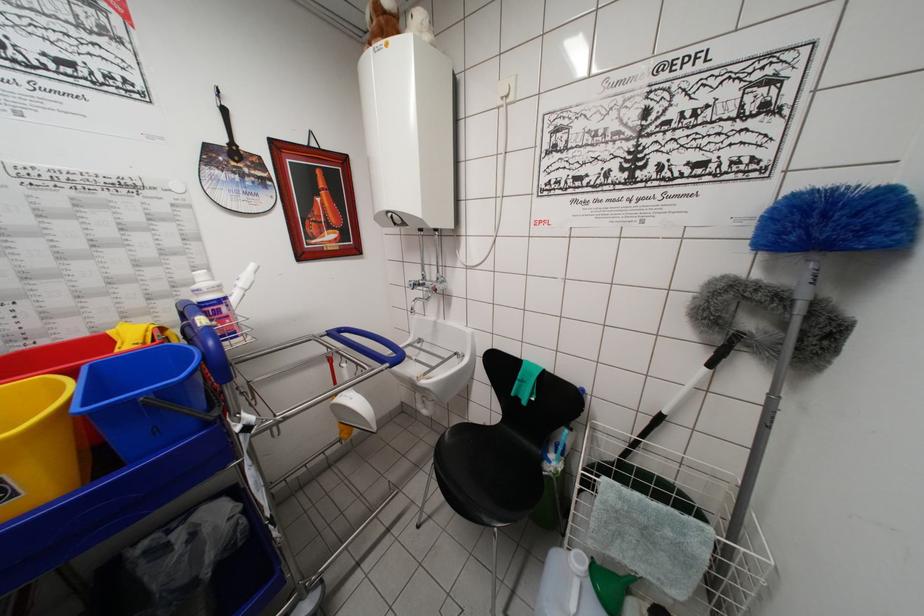
Find where to pull the sink faucet handle. Please return your answer as a coordinate pair (x, y).

(419, 301)